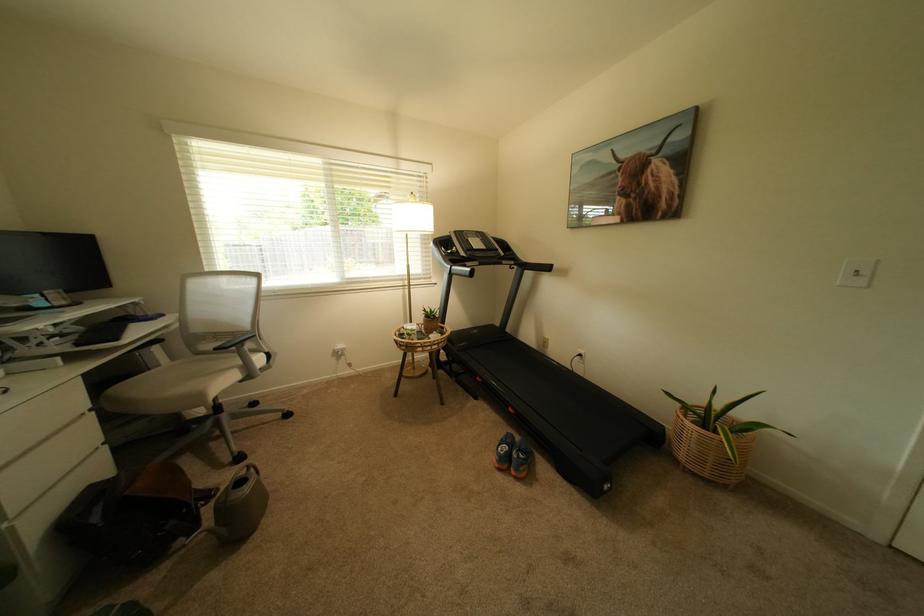
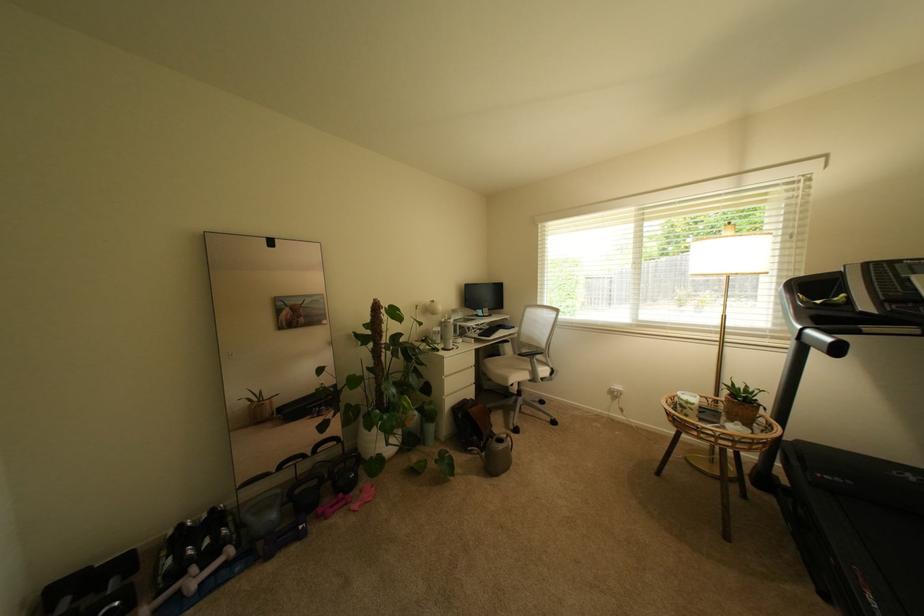
Find the pixel in the second image that matches [155,315] in the first image.

(517, 328)